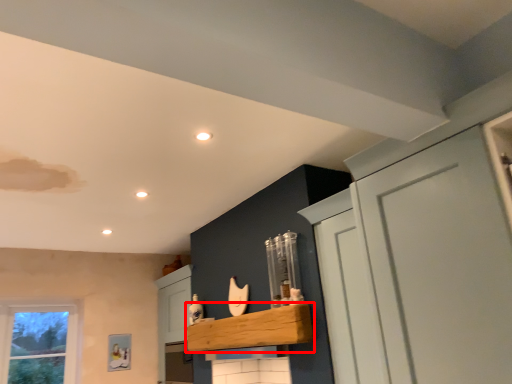
Question: From the image, what is the correct spatial relationship of cabinetry (annotated by the red box) in relation to cupboard?

Choices:
 (A) left
 (B) right

Answer: (A)